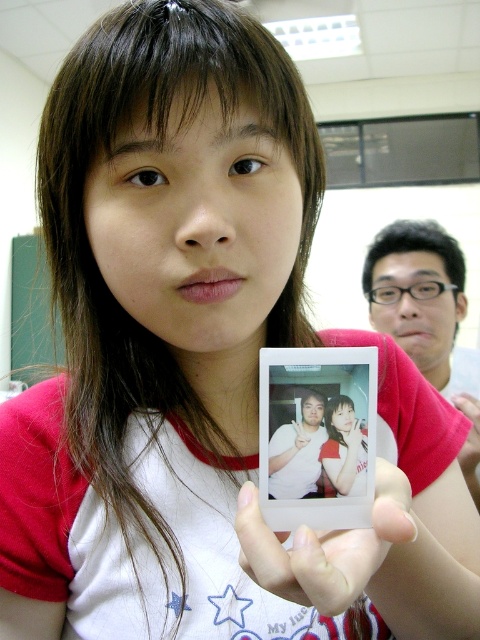
Consider the image. Between white matte polaroid at center and matte white photo at center, which one is positioned lower?

white matte polaroid at center is below.

Is white matte polaroid at center behind matte white photo at center?

That is False.

Which is in front, point (393, 492) or point (331, 452)?

Positioned in front is point (393, 492).

At what (x,y) coordinates should I click in order to perform the action: click on white matte polaroid at center. Please return your answer as a coordinate pair (x, y). Looking at the image, I should click on (339, 554).

Does white glossy photo frame at center appear under matte white instant photo at center?

No, white glossy photo frame at center is not below matte white instant photo at center.

Between white glossy photo frame at center and matte white instant photo at center, which one is positioned lower?

matte white instant photo at center

Between point (335, 467) and point (447, 330), which one is positioned behind?

Positioned behind is point (447, 330).

The height and width of the screenshot is (640, 480). I want to click on white glossy photo frame at center, so click(316, 436).

Between white glossy photo frame at center and matte white photo at center, which one is positioned higher?

white glossy photo frame at center is above.

Between white glossy photo frame at center and matte white photo at center, which one appears on the right side from the viewer's perspective?

matte white photo at center

Find the location of a particular element. The width and height of the screenshot is (480, 640). white glossy photo frame at center is located at coordinates coord(316,436).

This screenshot has height=640, width=480. Identify the location of white glossy photo frame at center. (316, 436).